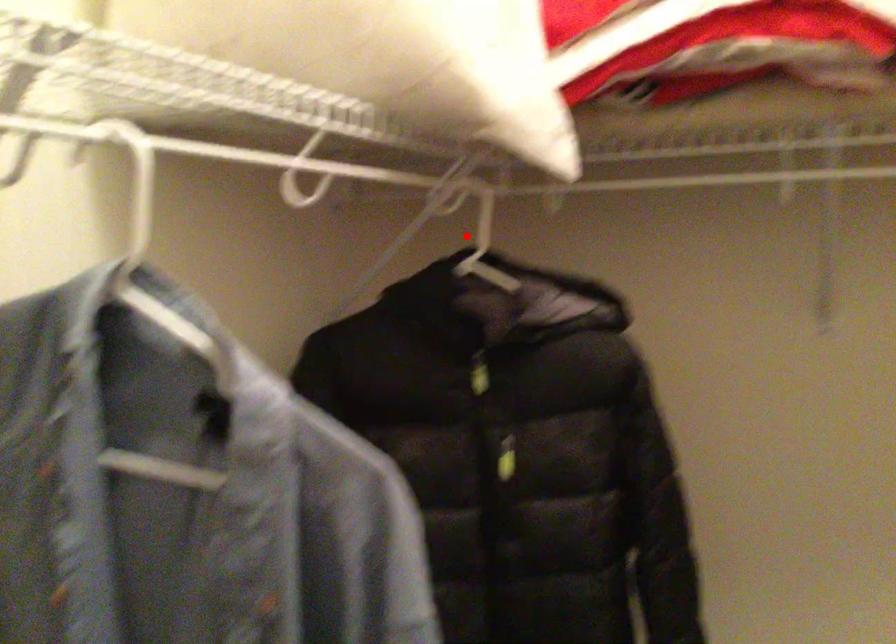
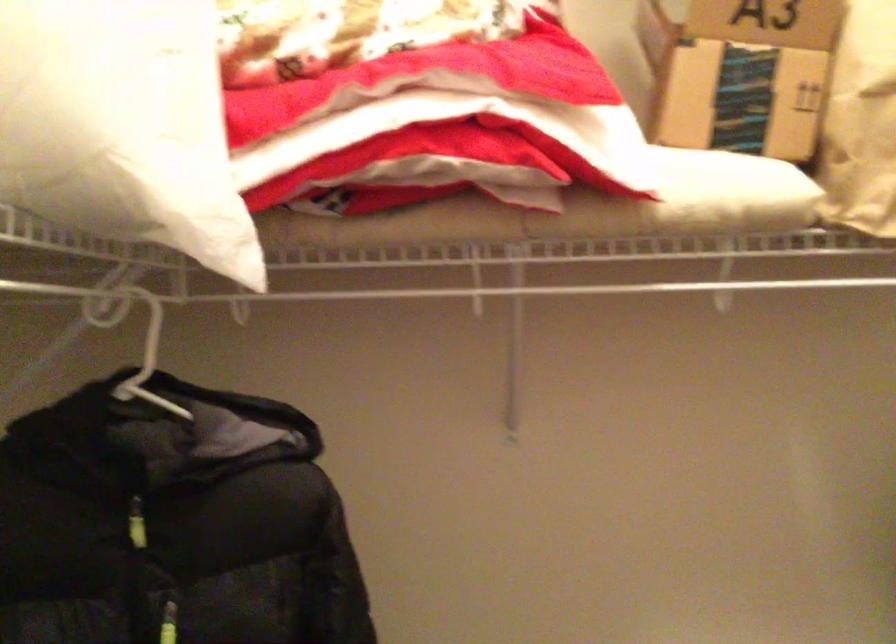
Locate, in the second image, the point that corresponds to the highlighted location in the first image.

(138, 344)